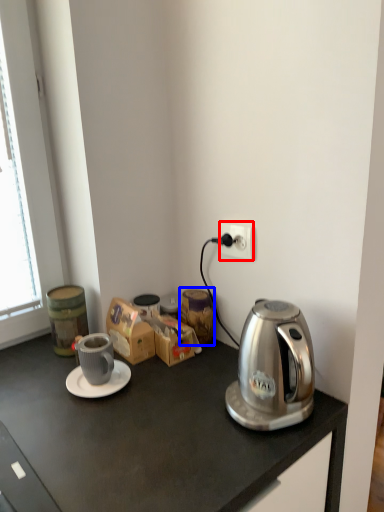
Question: Which of the following is the farthest to the observer, power outlet (highlighted by a red box) or appliance (highlighted by a blue box)?

Choices:
 (A) power outlet
 (B) appliance

Answer: (B)